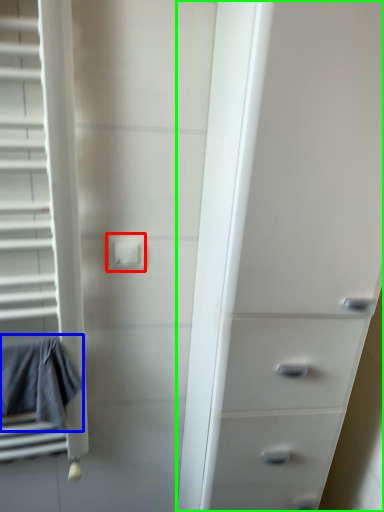
Question: Which object is positioned closest to electric outlet (highlighted by a red box)? Select from bath towel (highlighted by a blue box) and chest of drawers (highlighted by a green box).

Choices:
 (A) bath towel
 (B) chest of drawers

Answer: (A)